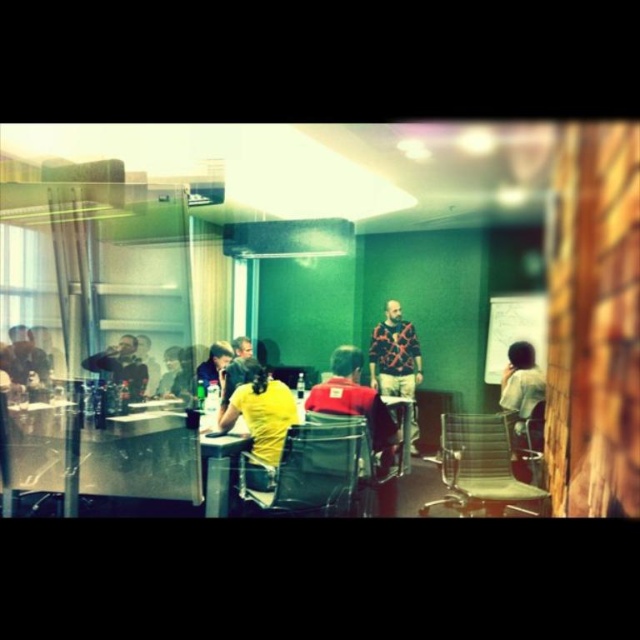
You are standing at the entrance of the meeting room and see the point marked as point (310, 468). What object is located at this point?

The transparent plastic chair at center is located at point (310, 468).

From the picture: You are organizing a small workshop and need to seat two participants. You have a transparent plastic chair at center and a metallic mesh chair at lower left. Which chair can accommodate a larger person comfortably?

The transparent plastic chair at center is larger in size than the metallic mesh chair at lower left, so it can accommodate a larger person more comfortably.

You are organizing a small meeting and need to seat two people. You have a transparent glass table at left and a metallic gray chair at lower right. Which object should you use to seat someone?

The metallic gray chair at lower right is the appropriate object for seating someone since chairs are designed for sitting, while the transparent glass table at left is meant for placing items or resting elbows.